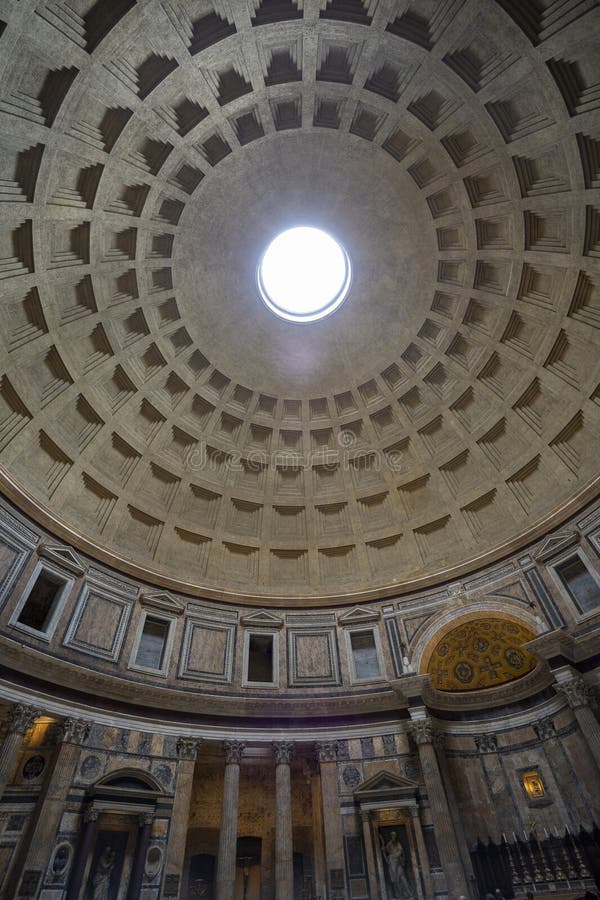
In order to click on pillar in this screenshot , I will do click(x=590, y=725), click(x=438, y=801), click(x=284, y=820), click(x=232, y=820), click(x=10, y=756).